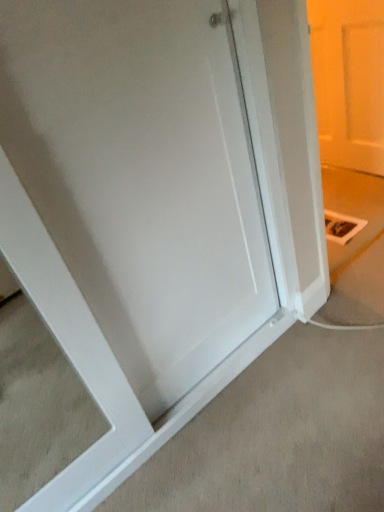
This screenshot has width=384, height=512. Describe the element at coordinates (279, 435) in the screenshot. I see `white smooth door at center` at that location.

The width and height of the screenshot is (384, 512). I want to click on white smooth door at center, so pos(279,435).

Measure the distance between point (371,80) and camera.

Point (371,80) is 2.15 meters away from camera.

Describe the element at coordinates (349, 81) in the screenshot. The width and height of the screenshot is (384, 512). I see `white matte door at upper right` at that location.

Where is `white matte door at upper right`? Image resolution: width=384 pixels, height=512 pixels. white matte door at upper right is located at coordinates (349, 81).

You are a GUI agent. You are given a task and a screenshot of the screen. Output one action in this format:
    pyautogui.click(x=<x>, y=<y>)
    Task: Click on the white smooth door at center
    
    Given the screenshot: What is the action you would take?
    click(x=279, y=435)

Considering the positions of objects white matte door at upper right and white smooth door at center in the image provided, who is more to the right, white matte door at upper right or white smooth door at center?

white matte door at upper right is more to the right.

Between white matte door at upper right and white smooth door at center, which one is positioned behind?

white matte door at upper right is further from the camera.

Does point (337, 20) come closer to viewer compared to point (178, 500)?

That is False.

Consider the image. From the image's perspective, does white matte door at upper right appear lower than white smooth door at center?

No, from the image's perspective, white matte door at upper right is not below white smooth door at center.

From a real-world perspective, is white matte door at upper right under white smooth door at center?

No, from a real-world perspective, white matte door at upper right is not under white smooth door at center.

In terms of width, does white matte door at upper right look wider or thinner when compared to white smooth door at center?

white matte door at upper right is thinner than white smooth door at center.

Based on the photo, considering the sizes of objects white matte door at upper right and white smooth door at center in the image provided, who is shorter, white matte door at upper right or white smooth door at center?

Standing shorter between the two is white smooth door at center.

Does white matte door at upper right have a larger size compared to white smooth door at center?

Incorrect, white matte door at upper right is not larger than white smooth door at center.

Can we say white matte door at upper right lies outside white smooth door at center?

Yes, white matte door at upper right is not within white smooth door at center.

Are white matte door at upper right and white smooth door at center far apart?

Indeed, white matte door at upper right is not near white smooth door at center.

Is white matte door at upper right positioned with its back to white smooth door at center?

No, white matte door at upper right's orientation is not away from white smooth door at center.

What's the angular difference between white matte door at upper right and white smooth door at center's facing directions?

There is a 89.1-degree angle between the facing directions of white matte door at upper right and white smooth door at center.

This screenshot has width=384, height=512. I want to click on door to the right of white smooth door at center, so click(x=349, y=81).

Which object is positioned more to the left, white smooth door at center or white matte door at upper right?

From the viewer's perspective, white smooth door at center appears more on the left side.

Is white smooth door at center closer to the viewer compared to white matte door at upper right?

Yes, white smooth door at center is closer to the camera.

Is point (253, 407) farther from camera compared to point (367, 75)?

No, it is not.

From the image's perspective, which object appears higher, white smooth door at center or white matte door at upper right?

white matte door at upper right.

From a real-world perspective, is white smooth door at center under white matte door at upper right?

Indeed, from a real-world perspective, white smooth door at center is positioned beneath white matte door at upper right.

Which of these two, white smooth door at center or white matte door at upper right, is wider?

white smooth door at center.

Between white smooth door at center and white matte door at upper right, which one has less height?

Standing shorter between the two is white smooth door at center.

From the picture: Does white smooth door at center have a smaller size compared to white matte door at upper right?

No, white smooth door at center is not smaller than white matte door at upper right.

Is white smooth door at center inside the boundaries of white matte door at upper right, or outside?

white smooth door at center is spatially situated outside white matte door at upper right.

Is white smooth door at center far from white matte door at upper right?

white smooth door at center is positioned a significant distance from white matte door at upper right.

Is white smooth door at center facing towards white matte door at upper right?

No, white smooth door at center is not oriented towards white matte door at upper right.

How many degrees apart are the facing directions of white smooth door at center and white matte door at upper right?

There is a 89.1-degree angle between the facing directions of white smooth door at center and white matte door at upper right.

In the scene shown: Measure the distance between white smooth door at center and white matte door at upper right.

white smooth door at center is 1.51 meters from white matte door at upper right.

Identify the location of door located behind the white smooth door at center. (349, 81).

What are the coordinates of `concrete on the left of the white matte door at upper right` in the screenshot? It's located at (279, 435).

At what (x,y) coordinates should I click in order to perform the action: click on concrete lying in front of the white matte door at upper right. Please return your answer as a coordinate pair (x, y). This screenshot has height=512, width=384. Looking at the image, I should click on (279, 435).